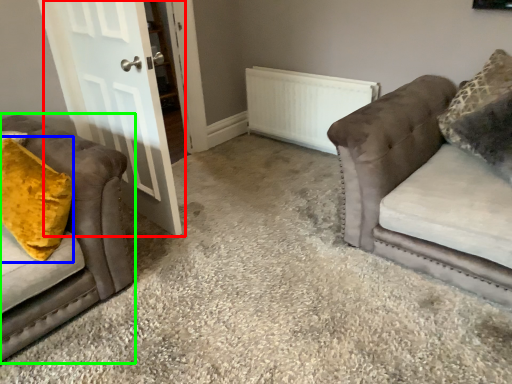
Question: Which is nearer to the door (highlighted by a red box)? throw pillow (highlighted by a blue box) or studio couch (highlighted by a green box).

Choices:
 (A) throw pillow
 (B) studio couch

Answer: (B)